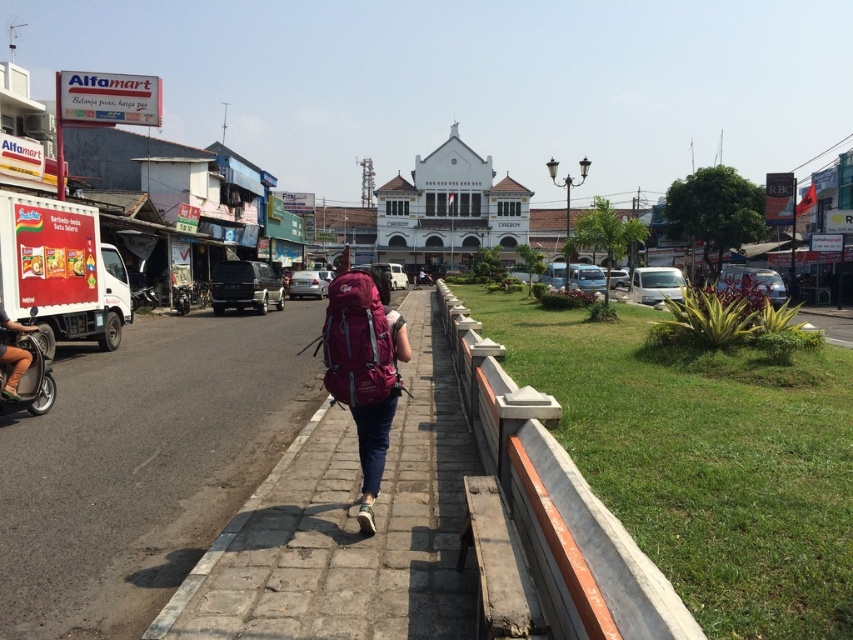
Between matte pink backpack at center and denim shorts at left, which one is positioned lower?

denim shorts at left

Which is behind, point (335, 381) or point (4, 356)?

The point (4, 356) is more distant.

Between point (361, 445) and point (16, 376), which one is positioned behind?

The point (16, 376) is behind.

Find the location of a particular element. matte pink backpack at center is located at coordinates (364, 368).

Is purple fabric backpack at center closer to camera compared to denim shorts at left?

Yes, it is.

Locate an element on the screen. purple fabric backpack at center is located at coordinates (357, 340).

Who is more forward, (374, 289) or (16, 365)?

Point (374, 289) is in front.

Locate an element on the screen. The image size is (853, 640). purple fabric backpack at center is located at coordinates (357, 340).

Is concrete at center to the left of metallic silver scooter at left from the viewer's perspective?

In fact, concrete at center is to the right of metallic silver scooter at left.

Is point (654, 605) in front of point (51, 397)?

Yes, point (654, 605) is closer to viewer.

The image size is (853, 640). I want to click on concrete at center, so click(556, 509).